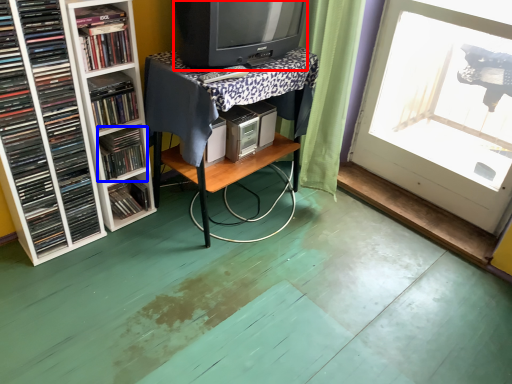
Question: Which object appears closest to the camera in this image, television (highlighted by a red box) or book (highlighted by a blue box)?

Choices:
 (A) television
 (B) book

Answer: (A)